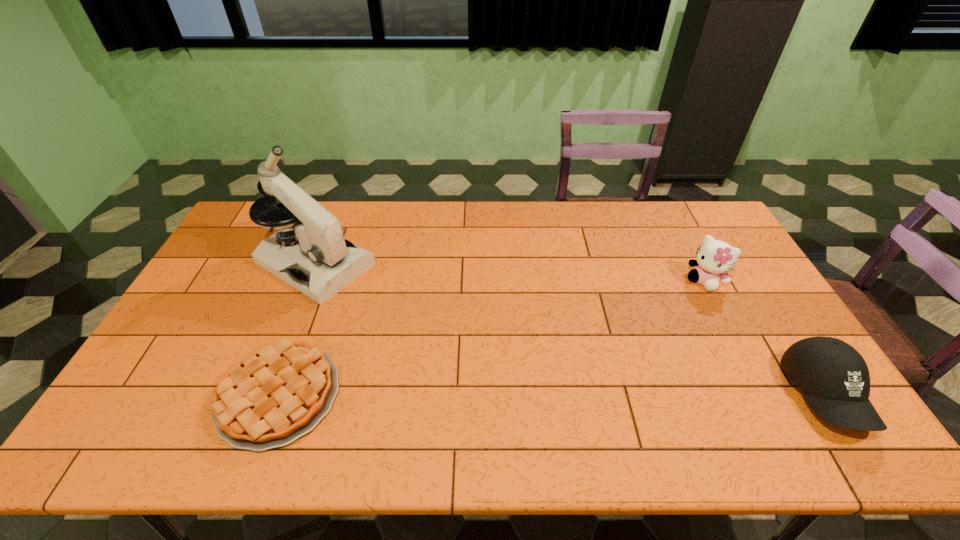
The image size is (960, 540). Find the location of `object positioned at the near right corner`. object positioned at the near right corner is located at coordinates (835, 379).

I want to click on free space at the far edge, so click(x=532, y=228).

At what (x,y) coordinates should I click in order to perform the action: click on vacant region at the near edge. Please return your answer as a coordinate pair (x, y). Looking at the image, I should click on (357, 397).

Identify the location of free space at the left edge of the desktop. point(178,363).

In the image, there is a desktop. At what (x,y) coordinates should I click in order to perform the action: click on vacant space at the right edge. Please return your answer as a coordinate pair (x, y). The image size is (960, 540). Looking at the image, I should click on (741, 263).

Locate an element on the screen. empty location between the baseball cap and the tallest object is located at coordinates (570, 329).

Identify the location of vacant region between the tallest object and the baseball cap. Image resolution: width=960 pixels, height=540 pixels. (570, 329).

Find the location of a particular element. This screenshot has height=540, width=960. free point between the pie and the baseball cap is located at coordinates (552, 395).

What are the coordinates of `empty location between the shortest object and the tallest object` in the screenshot? It's located at (298, 329).

This screenshot has height=540, width=960. I want to click on free point between the tallest object and the kitten, so click(510, 272).